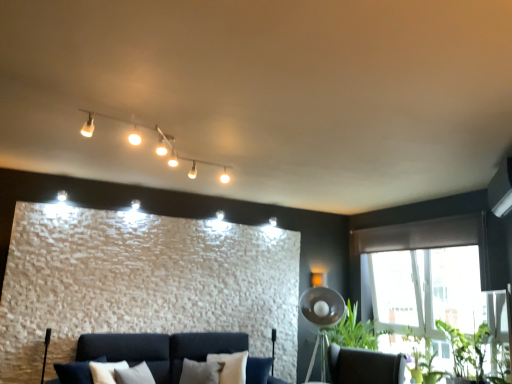
Describe the element at coordinates (421, 235) in the screenshot. I see `brown fabric curtain at upper right` at that location.

At what (x,y) coordinates should I click in order to perform the action: click on green leafy plant at lower right, the second plant in the back-to-front sequence. Please return your answer as a coordinate pair (x, y). Looking at the image, I should click on (467, 350).

What do you see at coordinates (321, 319) in the screenshot?
I see `metallic silver tripod lamp at lower right` at bounding box center [321, 319].

Identify the location of brown fabric curtain at upper right. Image resolution: width=512 pixels, height=384 pixels. (421, 235).

Measure the distance from matte white track lights at upper center to green matte plant at lower right, marked as the second plant in a front-to-back arrangement.

matte white track lights at upper center is 3.33 meters away from green matte plant at lower right, marked as the second plant in a front-to-back arrangement.

Does matte white track lights at upper center have a lesser height compared to green matte plant at lower right, marked as the second plant in a front-to-back arrangement?

Yes.

Between matte white track lights at upper center and green matte plant at lower right, marked as the second plant in a front-to-back arrangement, which one appears on the left side from the viewer's perspective?

matte white track lights at upper center.

Which is closer to the camera, (x=189, y=160) or (x=436, y=377)?

The point (x=189, y=160) is more forward.

Is there a large distance between metallic silver tripod lamp at lower right and brown fabric curtain at upper right?

metallic silver tripod lamp at lower right is positioned a significant distance from brown fabric curtain at upper right.

Identify the location of curtain above the metallic silver tripod lamp at lower right (from a real-world perspective). (421, 235).

From the image's perspective, would you say metallic silver tripod lamp at lower right is shown under brown fabric curtain at upper right?

Yes, from the image's perspective, metallic silver tripod lamp at lower right is below brown fabric curtain at upper right.

Considering the relative sizes of metallic silver tripod lamp at lower right and brown fabric curtain at upper right in the image provided, is metallic silver tripod lamp at lower right smaller than brown fabric curtain at upper right?

Incorrect, metallic silver tripod lamp at lower right is not smaller in size than brown fabric curtain at upper right.

In terms of size, does metallic silver tripod lamp at lower right appear bigger or smaller than matte white track lights at upper center?

Considering their sizes, metallic silver tripod lamp at lower right takes up more space than matte white track lights at upper center.

Which object is wider, metallic silver tripod lamp at lower right or matte white track lights at upper center?

With larger width is matte white track lights at upper center.

Where is `curtain located on the right of matte white track lights at upper center`? curtain located on the right of matte white track lights at upper center is located at coordinates (421, 235).

From a real-world perspective, which is physically above, brown fabric curtain at upper right or matte white track lights at upper center?

From a 3D spatial view, matte white track lights at upper center is above.

Which of these two, brown fabric curtain at upper right or matte white track lights at upper center, stands shorter?

With less height is matte white track lights at upper center.

Considering the relative sizes of green leafy plant at lower right, the second plant in the back-to-front sequence, and matte white track lights at upper center in the image provided, is green leafy plant at lower right, the second plant in the back-to-front sequence, bigger than matte white track lights at upper center?

Yes, green leafy plant at lower right, the second plant in the back-to-front sequence, is bigger than matte white track lights at upper center.

How different are the orientations of green leafy plant at lower right, which is the first plant from front to back, and matte white track lights at upper center in degrees?

98.4 degrees.

Could you tell me if green leafy plant at lower right, which is the first plant from front to back, is facing matte white track lights at upper center?

No, green leafy plant at lower right, which is the first plant from front to back, does not turn towards matte white track lights at upper center.

From a real-world perspective, is green leafy plant at lower right, which is the first plant from front to back, physically above matte white track lights at upper center?

No.

Which is in front, point (405, 333) or point (307, 294)?

The point (405, 333) is in front.

From a real-world perspective, which is physically below, green matte plant at lower right, marked as the second plant in a front-to-back arrangement, or metallic silver tripod lamp at lower right?

From a 3D spatial view, green matte plant at lower right, marked as the second plant in a front-to-back arrangement, is below.

Based on their positions, is green matte plant at lower right, acting as the 1th plant starting from the back, located to the left or right of metallic silver tripod lamp at lower right?

From the image, it's evident that green matte plant at lower right, acting as the 1th plant starting from the back, is to the right of metallic silver tripod lamp at lower right.

Is green matte plant at lower right, marked as the second plant in a front-to-back arrangement, positioned with its back to metallic silver tripod lamp at lower right?

No, green matte plant at lower right, marked as the second plant in a front-to-back arrangement,'s orientation is not away from metallic silver tripod lamp at lower right.

You are a GUI agent. You are given a task and a screenshot of the screen. Output one action in this format:
    pyautogui.click(x=<x>, y=<y>)
    Task: Click on the swivel chair lying on the right of metallic silver tripod lamp at lower right
    
    Given the screenshot: What is the action you would take?
    pyautogui.click(x=364, y=366)

In the scene shown: Which is more to the right, metallic silver tripod lamp at lower right or dark brown leather swivel chair at lower right?

From the viewer's perspective, dark brown leather swivel chair at lower right appears more on the right side.

Does metallic silver tripod lamp at lower right have a smaller size compared to dark brown leather swivel chair at lower right?

Yes, metallic silver tripod lamp at lower right is smaller than dark brown leather swivel chair at lower right.

Is metallic silver tripod lamp at lower right oriented away from dark brown leather swivel chair at lower right?

metallic silver tripod lamp at lower right does not have its back to dark brown leather swivel chair at lower right.

There is a matte white track lights at upper center. At what (x,y) coordinates should I click in order to perform the action: click on the 2nd plant below it (from the image's perspective). Please return your answer as a coordinate pair (x, y). Looking at the image, I should click on (422, 359).

The height and width of the screenshot is (384, 512). Find the location of `fan below the brown fabric curtain at upper right (from a real-world perspective)`. fan below the brown fabric curtain at upper right (from a real-world perspective) is located at coordinates (321, 319).

Which object lies further to the anchor point green leafy plant at lower right, which is the first plant from front to back, brown fabric curtain at upper right or matte white track lights at upper center?

Based on the image, matte white track lights at upper center appears to be further to green leafy plant at lower right, which is the first plant from front to back.

Based on their spatial positions, is green leafy plant at lower right, the second plant in the back-to-front sequence, or dark brown leather swivel chair at lower right closer to green matte plant at lower right, acting as the 1th plant starting from the back?

The object closer to green matte plant at lower right, acting as the 1th plant starting from the back, is green leafy plant at lower right, the second plant in the back-to-front sequence.

Which object lies further to the anchor point metallic silver tripod lamp at lower right, dark brown leather swivel chair at lower right or matte white track lights at upper center?

matte white track lights at upper center is positioned further to the anchor metallic silver tripod lamp at lower right.

Considering their positions, is green leafy plant at lower right, which is the first plant from front to back, positioned further to brown fabric curtain at upper right than dark brown leather swivel chair at lower right?

Among the two, dark brown leather swivel chair at lower right is located further to brown fabric curtain at upper right.

Estimate the real-world distances between objects in this image. Which object is closer to green matte plant at lower right, marked as the second plant in a front-to-back arrangement, brown fabric curtain at upper right or metallic silver tripod lamp at lower right?

metallic silver tripod lamp at lower right is positioned closer to the anchor green matte plant at lower right, marked as the second plant in a front-to-back arrangement.

In the scene shown: When comparing their distances from green leafy plant at lower right, the second plant in the back-to-front sequence, does green matte plant at lower right, acting as the 1th plant starting from the back, or brown fabric curtain at upper right seem further?

Based on the image, brown fabric curtain at upper right appears to be further to green leafy plant at lower right, the second plant in the back-to-front sequence.

Estimate the real-world distances between objects in this image. Which object is closer to green leafy plant at lower right, the second plant in the back-to-front sequence, matte white track lights at upper center or brown fabric curtain at upper right?

brown fabric curtain at upper right lies closer to green leafy plant at lower right, the second plant in the back-to-front sequence, than the other object.

Based on their spatial positions, is brown fabric curtain at upper right or green leafy plant at lower right, the second plant in the back-to-front sequence, further from green matte plant at lower right, acting as the 1th plant starting from the back?

brown fabric curtain at upper right lies further to green matte plant at lower right, acting as the 1th plant starting from the back, than the other object.

Locate an element on the screen. The width and height of the screenshot is (512, 384). plant that lies between brown fabric curtain at upper right and green matte plant at lower right, acting as the 1th plant starting from the back, from top to bottom is located at coordinates click(x=467, y=350).

Locate an element on the screen. fan between brown fabric curtain at upper right and green matte plant at lower right, acting as the 1th plant starting from the back, vertically is located at coordinates (321, 319).

In order to click on curtain between matte white track lights at upper center and green matte plant at lower right, marked as the second plant in a front-to-back arrangement, from left to right in this screenshot , I will do `click(421, 235)`.

Locate an element on the screen. The image size is (512, 384). curtain situated between matte white track lights at upper center and green leafy plant at lower right, which is the first plant from front to back, from left to right is located at coordinates (421, 235).